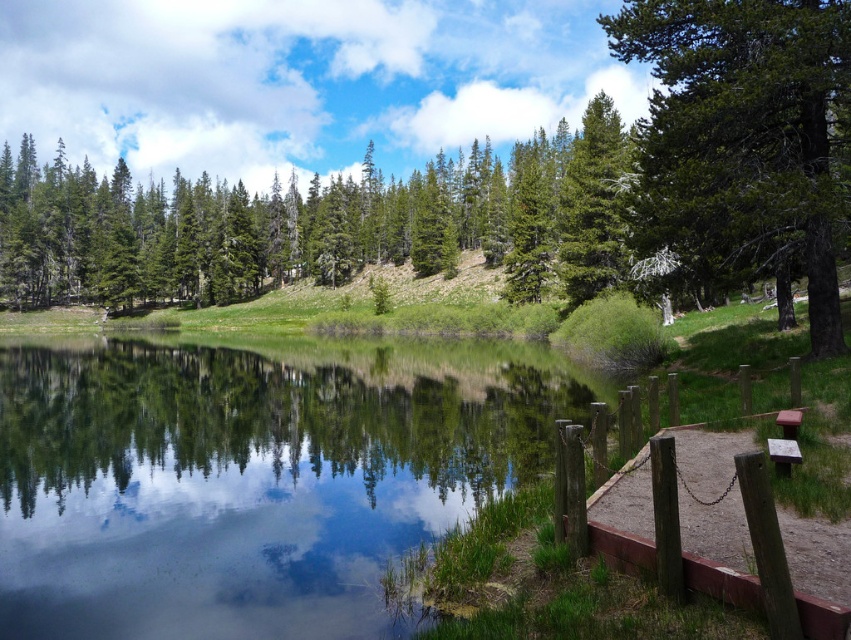
Question: Which of the following is the closest to the observer?

Choices:
 (A) (632, 481)
 (B) (614, 156)
 (C) (795, 461)
 (D) (817, 257)

Answer: (C)

Question: Is brown wooden dock at lower right closer to camera compared to brown wooden bench at lower right?

Choices:
 (A) yes
 (B) no

Answer: (A)

Question: Can you confirm if green rough bark tree at upper right is positioned to the left of brown wooden picnic table at lower right?

Choices:
 (A) no
 (B) yes

Answer: (A)

Question: Estimate the real-world distances between objects in this image. Which object is closer to the clear water at center?

Choices:
 (A) brown wooden bench at lower right
 (B) green matte tree at upper center
 (C) brown wooden dock at lower right

Answer: (B)

Question: Can you confirm if green matte tree at upper center is smaller than brown wooden bench at lower right?

Choices:
 (A) no
 (B) yes

Answer: (A)

Question: Which of the following is the farthest from the observer?

Choices:
 (A) clear water at center
 (B) brown wooden bench at lower right
 (C) brown wooden picnic table at lower right

Answer: (B)